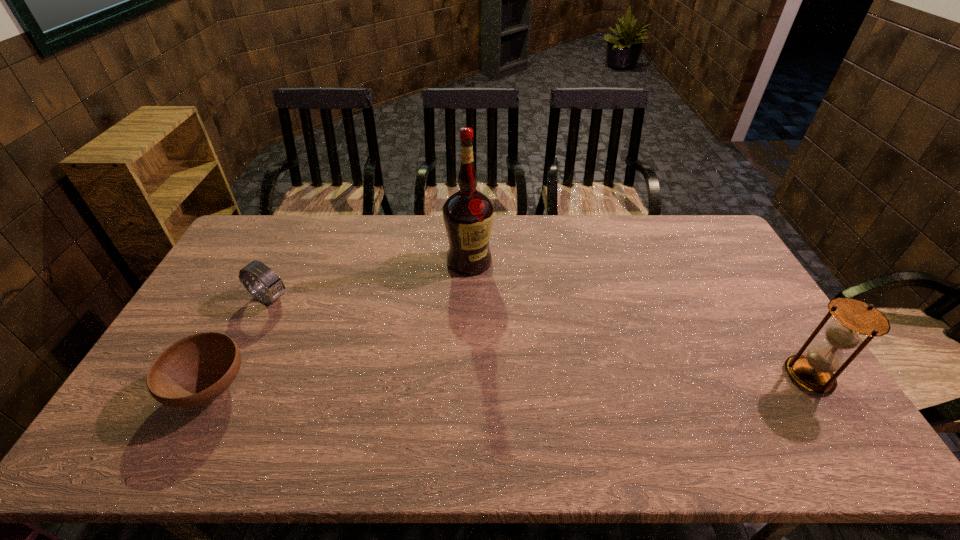
Where is `free space between the alcohol and the shortest object`? free space between the alcohol and the shortest object is located at coordinates (340, 325).

Where is `vacant region between the bowl and the rightmost object`? vacant region between the bowl and the rightmost object is located at coordinates (510, 382).

You are a GUI agent. You are given a task and a screenshot of the screen. Output one action in this format:
    pyautogui.click(x=<x>, y=<y>)
    Task: Click on the vacant area between the tallest object and the second farthest object
    The width and height of the screenshot is (960, 540).
    Given the screenshot: What is the action you would take?
    pyautogui.click(x=370, y=280)

The height and width of the screenshot is (540, 960). What are the coordinates of `free area in between the shortest object and the third shortest object` in the screenshot? It's located at (510, 382).

Where is `unoccupied area between the third object from left to right and the hourglass`? The image size is (960, 540). unoccupied area between the third object from left to right and the hourglass is located at coordinates tap(639, 319).

Image resolution: width=960 pixels, height=540 pixels. Find the location of `vacant space that is in between the second farthest object and the tallest object`. vacant space that is in between the second farthest object and the tallest object is located at coordinates (370, 280).

The width and height of the screenshot is (960, 540). I want to click on free space between the farthest object and the bowl, so click(x=340, y=325).

Identify which object is the second closest to the second farthest object. Please provide its 2D coordinates. Your answer should be formatted as a tuple, i.e. [(x, y)], where the tuple contains the x and y coordinates of a point satisfying the conditions above.

[(468, 215)]

Locate which object ranks second in proximity to the bowl. Please provide its 2D coordinates. Your answer should be formatted as a tuple, i.e. [(x, y)], where the tuple contains the x and y coordinates of a point satisfying the conditions above.

[(468, 215)]

At what (x,y) coordinates should I click in order to perform the action: click on blank area in the image that satisfies the following two spatial constraints: 1. on the back side of the bowl; 2. on the left side of the second tallest object. Please return your answer as a coordinate pair (x, y). This screenshot has width=960, height=540. Looking at the image, I should click on (217, 376).